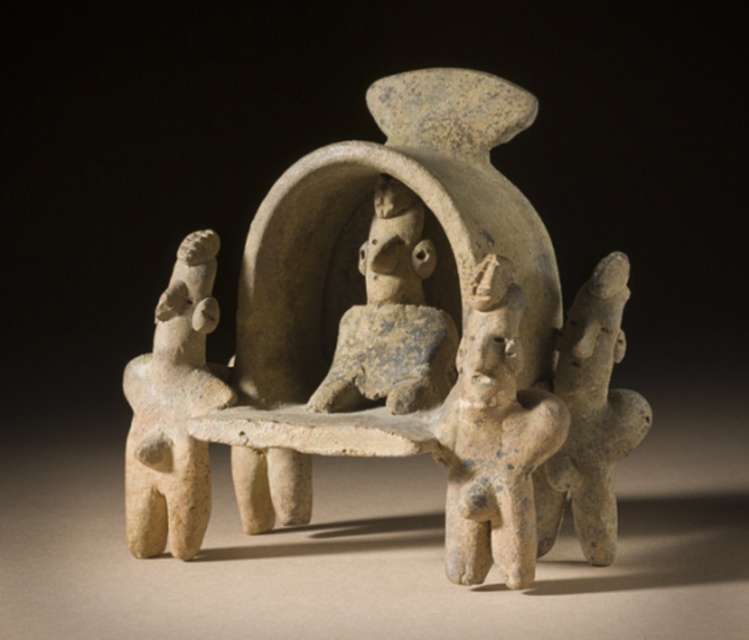
Is speckled clay figure at center below gray stone figure at right?

No.

Does speckled clay figure at center lie in front of gray stone figure at right?

No, it is behind gray stone figure at right.

This screenshot has height=640, width=749. What do you see at coordinates (391, 317) in the screenshot?
I see `speckled clay figure at center` at bounding box center [391, 317].

This screenshot has width=749, height=640. What are the coordinates of `speckled clay figure at center` in the screenshot? It's located at (391, 317).

Between point (157, 538) and point (557, 513), which one is positioned behind?

Point (157, 538)

Does point (133, 400) lie in front of point (628, 429)?

No.

Identify the location of speckled beige figurine at left. This screenshot has height=640, width=749. (172, 410).

Can you confirm if speckled stone figure at center is wider than gray stone figure at right?

Indeed, speckled stone figure at center has a greater width compared to gray stone figure at right.

Does point (451, 88) come closer to viewer compared to point (616, 317)?

That is False.

Where is `speckled stone figure at center`? speckled stone figure at center is located at coordinates (398, 308).